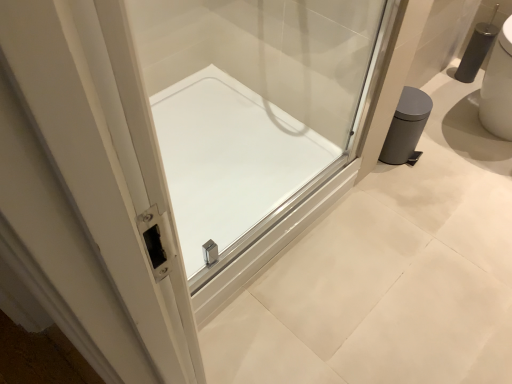
This screenshot has height=384, width=512. What do you see at coordinates (233, 165) in the screenshot? I see `white glossy bath at center` at bounding box center [233, 165].

Identify the location of white glossy bath at center. (233, 165).

Find the location of a particular element. The image size is (512, 384). white glossy bath at center is located at coordinates (233, 165).